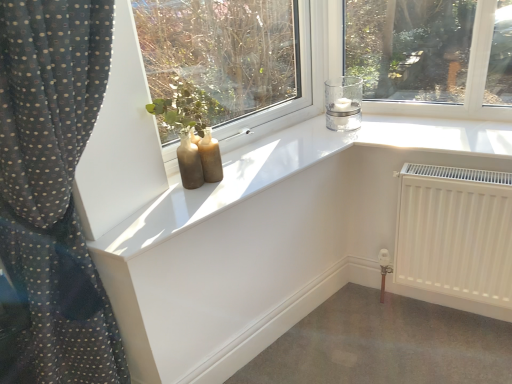
At what (x,y) coordinates should I click in order to perform the action: click on vacant space situated on the left part of white matte radiator at lower right. Please return your answer as a coordinate pair (x, y). The width and height of the screenshot is (512, 384). Looking at the image, I should click on (375, 333).